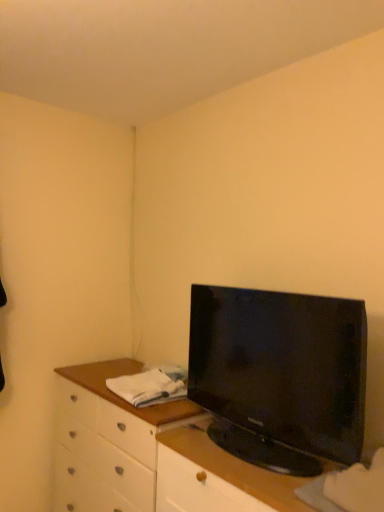
Locate an element on the screen. The width and height of the screenshot is (384, 512). matte black tv at center is located at coordinates (280, 376).

This screenshot has width=384, height=512. Describe the element at coordinates (280, 376) in the screenshot. I see `matte black tv at center` at that location.

Where is `matte black tv at center`? matte black tv at center is located at coordinates (280, 376).